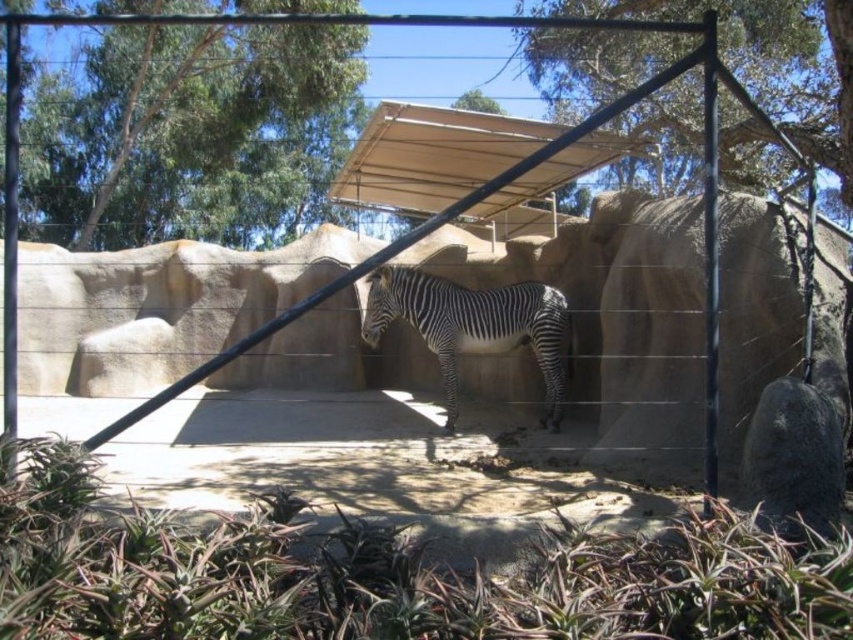
Who is taller, green leafy tree at upper center or black and white striped zebra at center?

green leafy tree at upper center is taller.

Is point (766, 81) positioned behind point (381, 310)?

Yes, point (766, 81) is behind point (381, 310).

Image resolution: width=853 pixels, height=640 pixels. In order to click on green leafy tree at upper center in this screenshot , I will do `click(763, 64)`.

Who is lower down, green leafy tree at upper left or green leafy tree at upper center?

green leafy tree at upper center

Who is taller, green leafy tree at upper left or green leafy tree at upper center?

green leafy tree at upper left

Who is more forward, (88, 88) or (805, 129)?

Point (805, 129) is in front.

Locate an element on the screen. green leafy tree at upper left is located at coordinates (189, 132).

Is green leafy tree at upper left to the left of beige fabric canopy at center from the viewer's perspective?

Yes, green leafy tree at upper left is to the left of beige fabric canopy at center.

Is point (280, 221) positioned in front of point (534, 170)?

No, (280, 221) is behind (534, 170).

I want to click on green leafy tree at upper left, so click(189, 132).